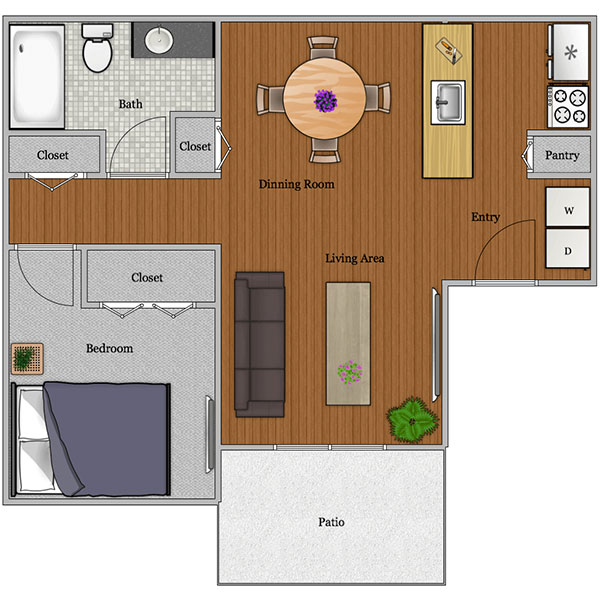
The width and height of the screenshot is (600, 600). What are the coordinates of `television screen` in the screenshot? It's located at (207, 437), (435, 347).